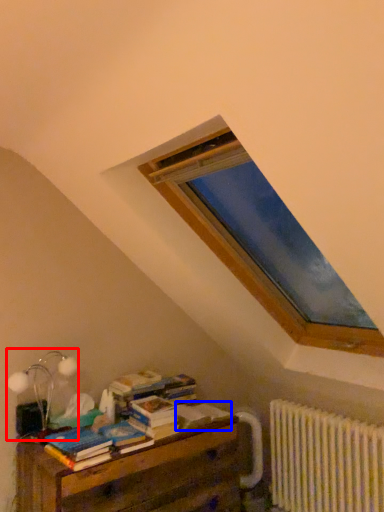
Question: Which object is further to the camera taking this photo, table lamp (highlighted by a red box) or paperback book (highlighted by a blue box)?

Choices:
 (A) table lamp
 (B) paperback book

Answer: (B)